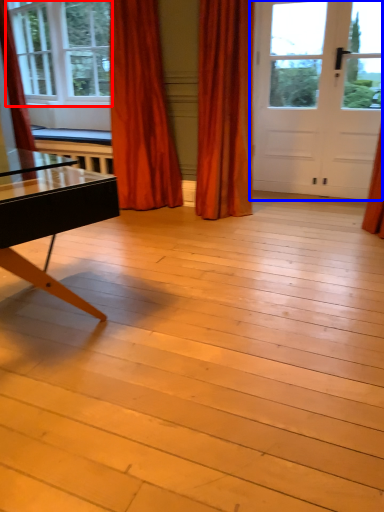
Question: Which of the following is the farthest to the observer, window (highlighted by a red box) or door (highlighted by a blue box)?

Choices:
 (A) window
 (B) door

Answer: (A)